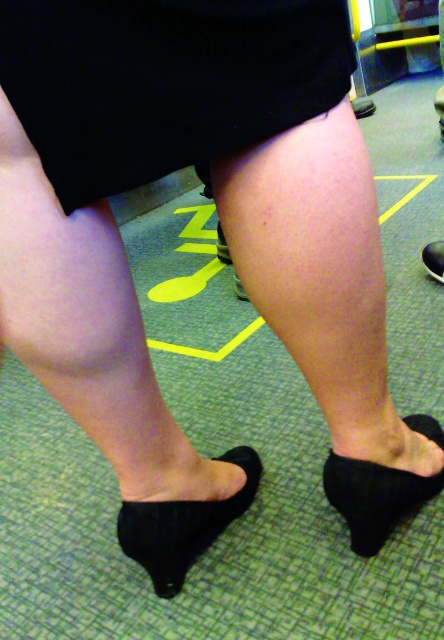
Does smooth skin leg at center have a lesser height compared to black suede shoe at lower right?

Incorrect, smooth skin leg at center's height does not fall short of black suede shoe at lower right's.

Which of these two, smooth skin leg at center or black suede shoe at lower right, stands shorter?

With less height is black suede shoe at lower right.

Between point (433, 472) and point (443, 260), which one is positioned behind?

The point (443, 260) is behind.

Where is `smooth skin leg at center`? The image size is (444, 640). smooth skin leg at center is located at coordinates (329, 308).

The width and height of the screenshot is (444, 640). I want to click on suede skirt at center, so click(x=163, y=81).

Does suede skirt at center have a smaller size compared to black suede high-heeled shoe at lower center?

Yes, suede skirt at center is smaller than black suede high-heeled shoe at lower center.

I want to click on suede skirt at center, so click(x=163, y=81).

Locate an element on the screen. This screenshot has height=640, width=444. suede skirt at center is located at coordinates (163, 81).

Who is positioned more to the left, black suede mule at lower center or black suede shoe at lower right?

Positioned to the left is black suede mule at lower center.

Between black suede mule at lower center and black suede shoe at lower right, which one is positioned lower?

black suede mule at lower center is below.

The image size is (444, 640). In order to click on black suede mule at lower center in this screenshot , I will do `click(182, 525)`.

Locate an element on the screen. black suede mule at lower center is located at coordinates (182, 525).